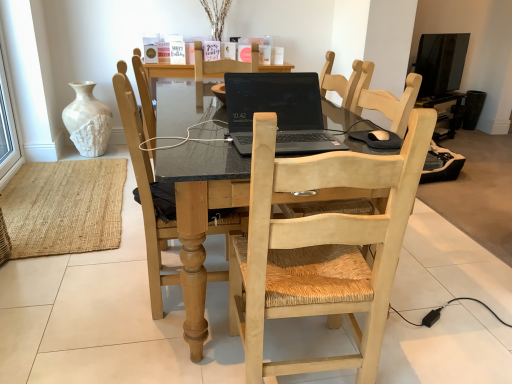
Question: Considering the positions of light wood woven seat at center, the 2th chair in the left-to-right sequence, and black matte laptop at center in the image, is light wood woven seat at center, the 2th chair in the left-to-right sequence, bigger or smaller than black matte laptop at center?

Choices:
 (A) big
 (B) small

Answer: (A)

Question: Is light wood woven seat at center, arranged as the first chair when viewed from the right, inside or outside of black matte laptop at center?

Choices:
 (A) outside
 (B) inside

Answer: (A)

Question: Which object is the closest to the transparent glass window at left?

Choices:
 (A) light wood chair at center, which is the 1th chair in left-to-right order
 (B) black glossy tv at upper right
 (C) black matte laptop at center
 (D) white textured vase at upper left
 (E) light wood woven seat at center, arranged as the first chair when viewed from the right

Answer: (D)

Question: Based on their relative distances, which object is farther from the light wood woven seat at center, arranged as the first chair when viewed from the right?

Choices:
 (A) black glossy tv at upper right
 (B) black matte laptop at center
 (C) light wood chair at center, the second chair when ordered from right to left
 (D) white textured vase at upper left
 (E) transparent glass window at left

Answer: (A)